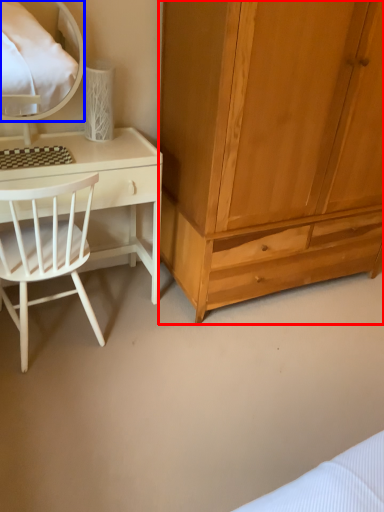
Question: Which object appears closest to the camera in this image, cabinetry (highlighted by a red box) or mirror (highlighted by a blue box)?

Choices:
 (A) cabinetry
 (B) mirror

Answer: (A)